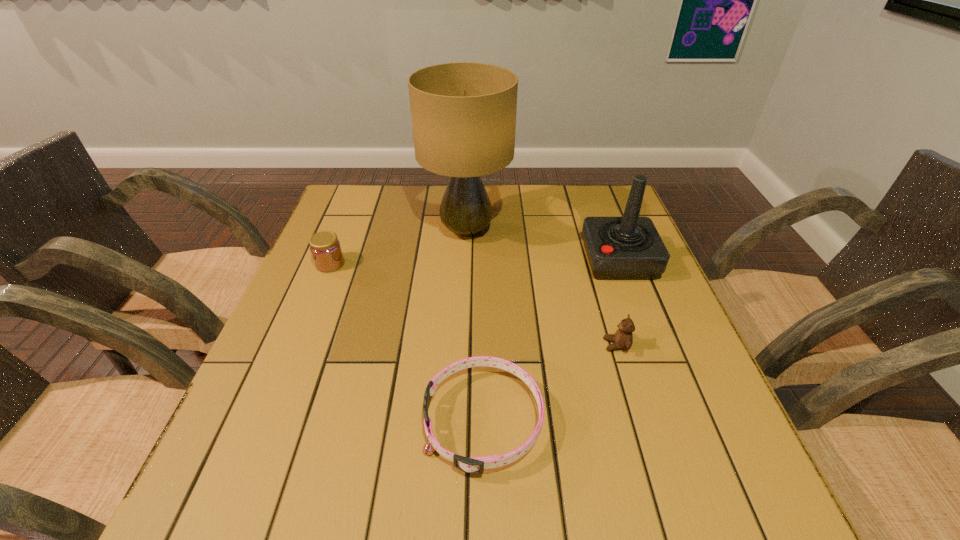
Locate an element on the screen. The height and width of the screenshot is (540, 960). joystick that is at the right edge is located at coordinates (618, 248).

Find the location of a particular element. teddy bear situated at the right edge is located at coordinates (623, 339).

I want to click on vacant space at the far edge of the desktop, so click(514, 195).

Locate an element on the screen. blank space at the near edge of the desktop is located at coordinates (396, 503).

Find the location of a particular element. blank area at the left edge is located at coordinates (x=370, y=231).

The width and height of the screenshot is (960, 540). In the image, there is a desktop. What are the coordinates of `vacant space at the right edge` in the screenshot? It's located at (691, 377).

This screenshot has height=540, width=960. I want to click on blank space at the far left corner of the desktop, so [x=341, y=190].

The height and width of the screenshot is (540, 960). What are the coordinates of `vacant space at the far right corner of the desktop` in the screenshot? It's located at (582, 214).

Image resolution: width=960 pixels, height=540 pixels. What are the coordinates of `empty location between the leftmost object and the second nearest object` in the screenshot? It's located at (473, 305).

This screenshot has height=540, width=960. What are the coordinates of `free area in between the joystick and the jam` in the screenshot? It's located at (474, 262).